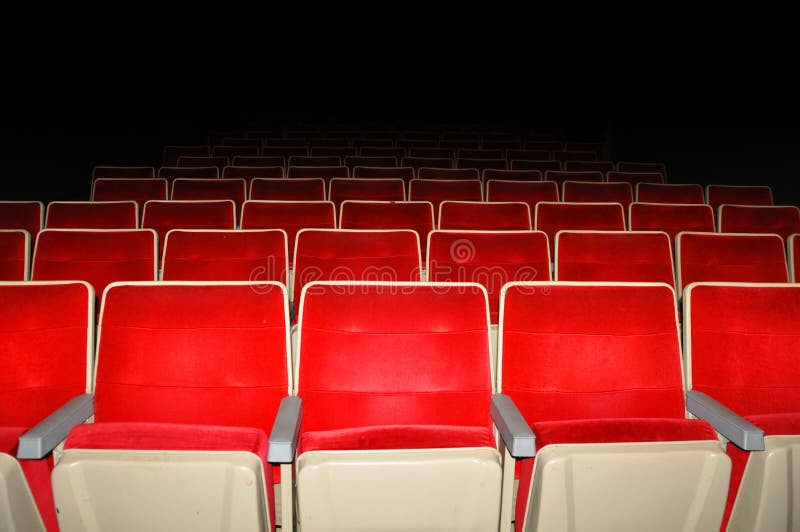
Identify the location of gray seat arms. This screenshot has width=800, height=532. (733, 421), (500, 423), (278, 442), (38, 418).